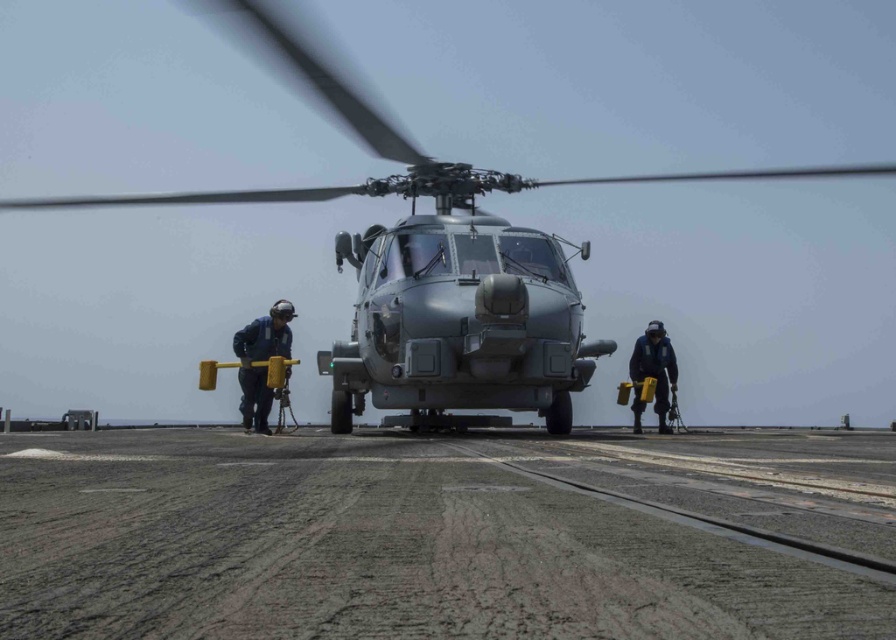
Does metallic gray helicopter at center come in front of gray asphalt tarmac at center?

No, metallic gray helicopter at center is behind gray asphalt tarmac at center.

Does point (837, 148) lie in front of point (427, 536)?

No, it is not.

At what (x,y) coordinates should I click in order to perform the action: click on metallic gray helicopter at center. Please return your answer as a coordinate pair (x, y). Looking at the image, I should click on (619, 80).

Can you confirm if metallic gray helicopter at center is positioned above dark blue uniform at right?

Yes, metallic gray helicopter at center is above dark blue uniform at right.

At what (x,y) coordinates should I click in order to perform the action: click on metallic gray helicopter at center. Please return your answer as a coordinate pair (x, y). The height and width of the screenshot is (640, 896). Looking at the image, I should click on (619, 80).

Is blue uniform at left to the left of dark blue uniform at right from the viewer's perspective?

Correct, you'll find blue uniform at left to the left of dark blue uniform at right.

Find the location of a particular element. blue uniform at left is located at coordinates (261, 358).